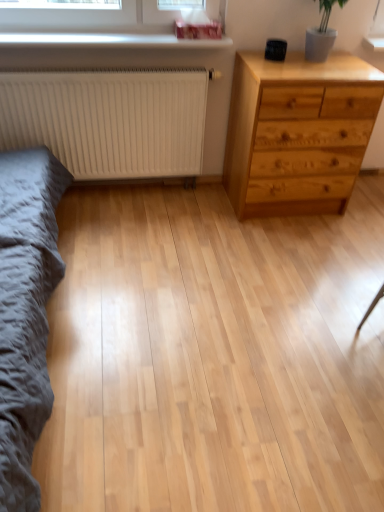
You are a GUI agent. You are given a task and a screenshot of the screen. Output one action in this format:
    pyautogui.click(x=<x>, y=<y>)
    Task: Click on the vacant area that lies to the right of white matte radiator at left
    The width and height of the screenshot is (384, 512).
    Given the screenshot: What is the action you would take?
    pyautogui.click(x=211, y=222)